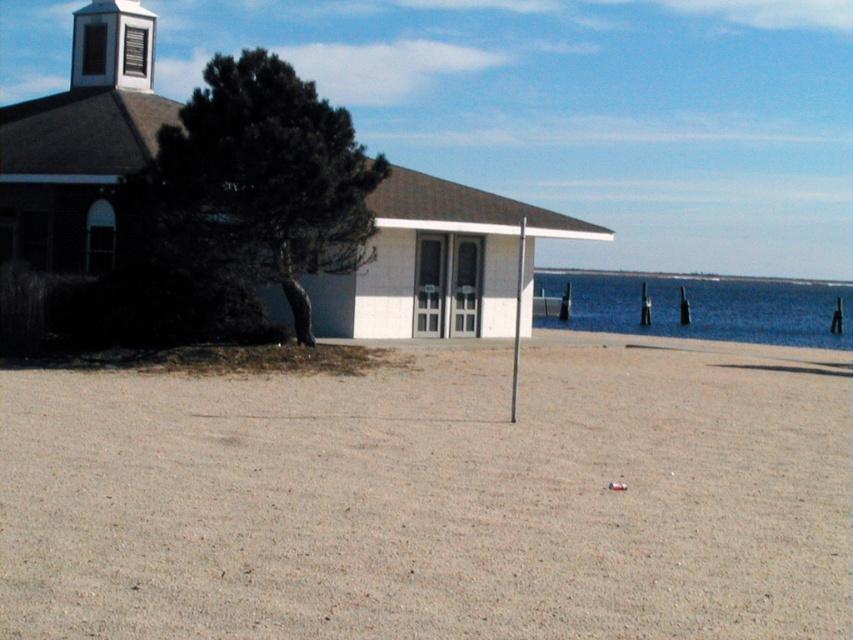
Question: Can you confirm if brown sandy dirt at center is positioned above blue water at lower right?

Choices:
 (A) no
 (B) yes

Answer: (A)

Question: Which point is farther from the camera taking this photo?

Choices:
 (A) (51, 492)
 (B) (647, 291)

Answer: (B)

Question: Is white matte building at center below blue water at lower right?

Choices:
 (A) no
 (B) yes

Answer: (A)

Question: Which point appears closest to the camera in this image?

Choices:
 (A) (683, 336)
 (B) (352, 616)

Answer: (B)

Question: Which object appears farthest from the camera in this image?

Choices:
 (A) blue water at lower right
 (B) white matte building at center
 (C) brown sandy dirt at center

Answer: (A)

Question: Can you confirm if brown sandy dirt at center is bigger than blue water at lower right?

Choices:
 (A) no
 (B) yes

Answer: (A)